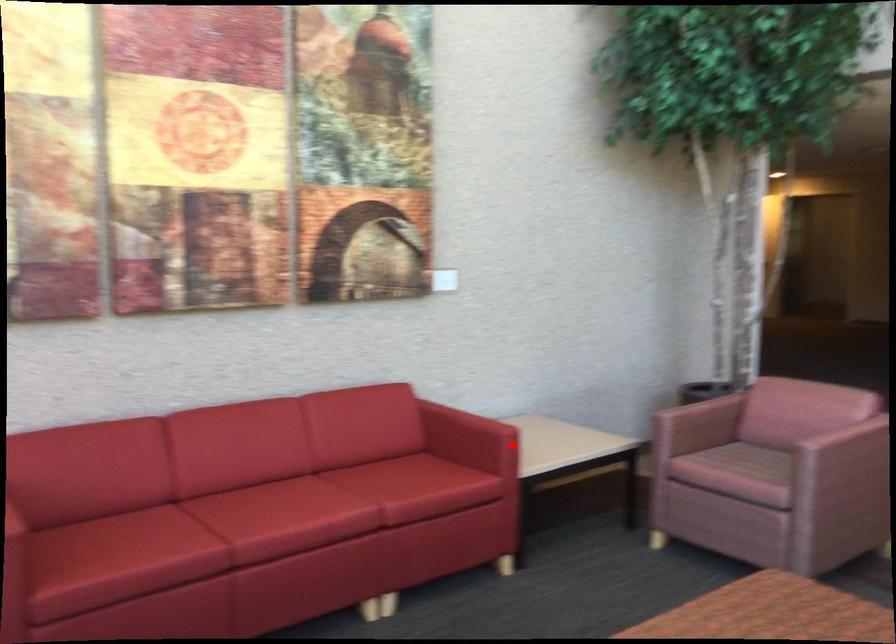
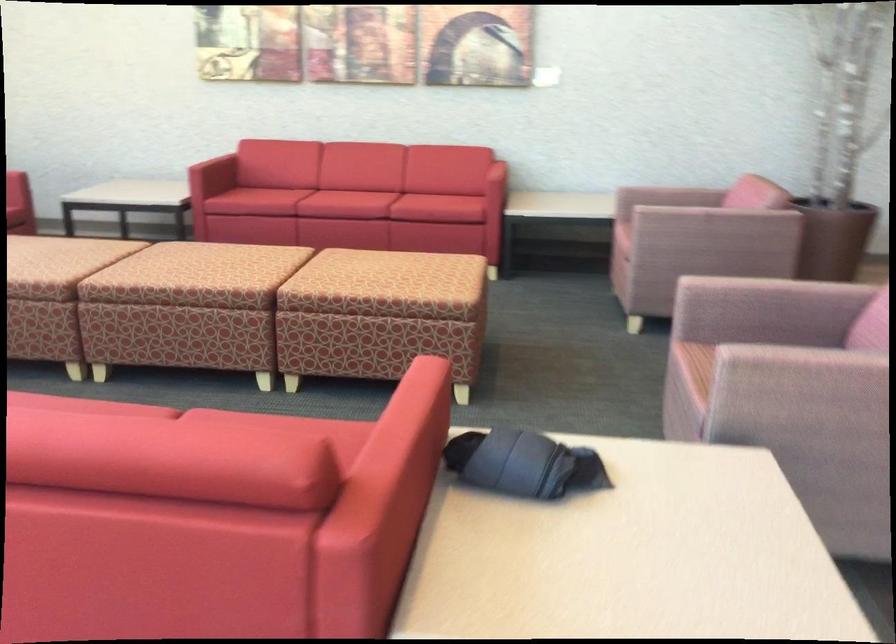
Question: I am providing you with two images of the same scene from different viewpoints. Image1 has a red point marked. In image2, the corresponding 3D location appears at what relative position? Reply with the corresponding letter.

Choices:
 (A) Closer
 (B) Farther

Answer: (B)